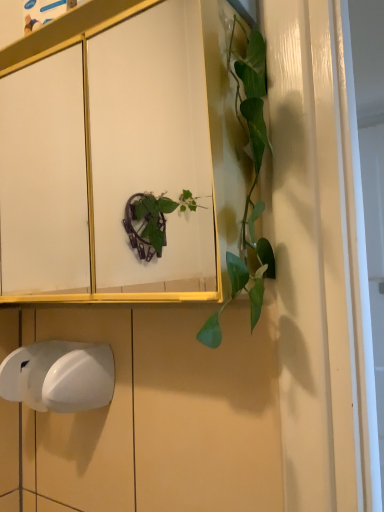
Question: Should I look upward or downward to see white plastic hand dryer at lower left?

Choices:
 (A) up
 (B) down

Answer: (B)

Question: Is the depth of white glossy cabinet at upper center greater than that of white plastic hand dryer at lower left?

Choices:
 (A) no
 (B) yes

Answer: (A)

Question: Is white glossy cabinet at upper center with white plastic hand dryer at lower left?

Choices:
 (A) yes
 (B) no

Answer: (B)

Question: Does white glossy cabinet at upper center have a smaller size compared to white plastic hand dryer at lower left?

Choices:
 (A) no
 (B) yes

Answer: (A)

Question: Is white glossy cabinet at upper center shorter than white plastic hand dryer at lower left?

Choices:
 (A) yes
 (B) no

Answer: (B)

Question: Is white glossy cabinet at upper center taller than white plastic hand dryer at lower left?

Choices:
 (A) no
 (B) yes

Answer: (B)

Question: Does white glossy cabinet at upper center lie in front of white plastic hand dryer at lower left?

Choices:
 (A) no
 (B) yes

Answer: (B)

Question: Can you confirm if white plastic hand dryer at lower left is taller than white glossy cabinet at upper center?

Choices:
 (A) yes
 (B) no

Answer: (B)

Question: Is white plastic hand dryer at lower left far away from white glossy cabinet at upper center?

Choices:
 (A) no
 (B) yes

Answer: (B)

Question: Is the surface of white plastic hand dryer at lower left in direct contact with white glossy cabinet at upper center?

Choices:
 (A) yes
 (B) no

Answer: (B)

Question: Is white plastic hand dryer at lower left aimed at white glossy cabinet at upper center?

Choices:
 (A) yes
 (B) no

Answer: (B)

Question: Does white plastic hand dryer at lower left come behind white glossy cabinet at upper center?

Choices:
 (A) no
 (B) yes

Answer: (B)

Question: From the image's perspective, would you say white plastic hand dryer at lower left is positioned over white glossy cabinet at upper center?

Choices:
 (A) yes
 (B) no

Answer: (B)

Question: Is white glossy cabinet at upper center wider or thinner than white plastic hand dryer at lower left?

Choices:
 (A) wide
 (B) thin

Answer: (A)